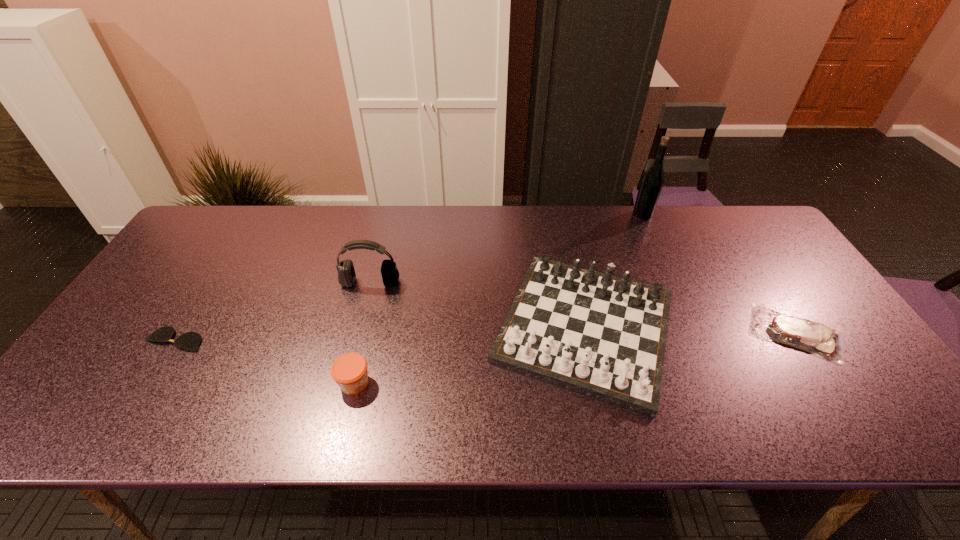
Where is `free point located on the headband of the fifth shortest object`? This screenshot has height=540, width=960. free point located on the headband of the fifth shortest object is located at coordinates (341, 399).

Find the location of a particular element. The height and width of the screenshot is (540, 960). vacant space located on the left of the fourth shortest object is located at coordinates (448, 327).

At what (x,y) coordinates should I click in order to perform the action: click on blank area located 0.090m on the front label of the jam. Please return your answer as a coordinate pair (x, y). The height and width of the screenshot is (540, 960). Looking at the image, I should click on (411, 383).

At what (x,y) coordinates should I click in order to perform the action: click on free region located 0.150m on the left of the second shortest object. Please return your answer as a coordinate pair (x, y). Looking at the image, I should click on (689, 333).

I want to click on vacant space located on the front of the spectacles, so click(x=152, y=377).

This screenshot has width=960, height=540. Identify the location of object situated at the far edge. (652, 182).

The image size is (960, 540). What are the coordinates of `object situated at the near edge` in the screenshot? It's located at (604, 336).

At what (x,y) coordinates should I click in order to perform the action: click on object that is at the left edge. Please return your answer as a coordinate pair (x, y). Looking at the image, I should click on click(x=190, y=341).

Where is `object that is positioned at the right edge`? The height and width of the screenshot is (540, 960). object that is positioned at the right edge is located at coordinates (814, 337).

You are a GUI agent. You are given a task and a screenshot of the screen. Output one action in this format:
    pyautogui.click(x=<x>, y=<y>)
    Task: Click on the free space at the far edge
    
    Given the screenshot: What is the action you would take?
    pyautogui.click(x=684, y=223)